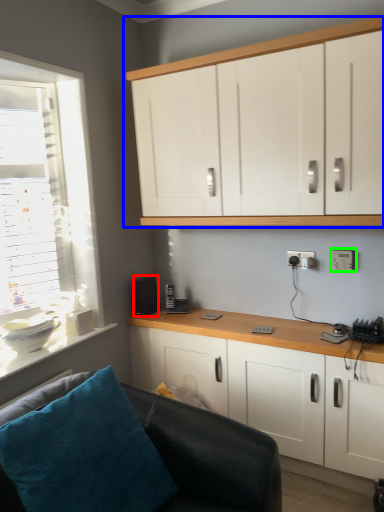
Question: Which object is the farthest from speaker (highlighted by a red box)? Choose among these: cabinetry (highlighted by a blue box) or electric outlet (highlighted by a green box).

Choices:
 (A) cabinetry
 (B) electric outlet

Answer: (A)